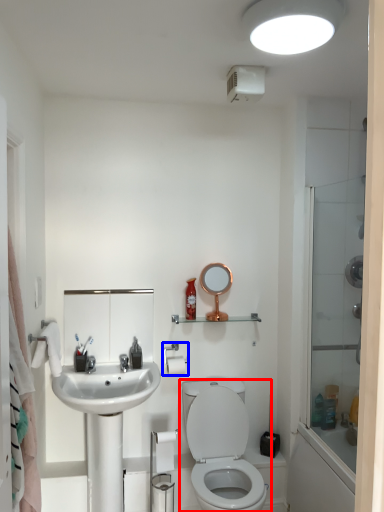
Question: Among these objects, which one is farthest to the camera, toilet (highlighted by a red box) or toilet paper (highlighted by a blue box)?

Choices:
 (A) toilet
 (B) toilet paper

Answer: (B)